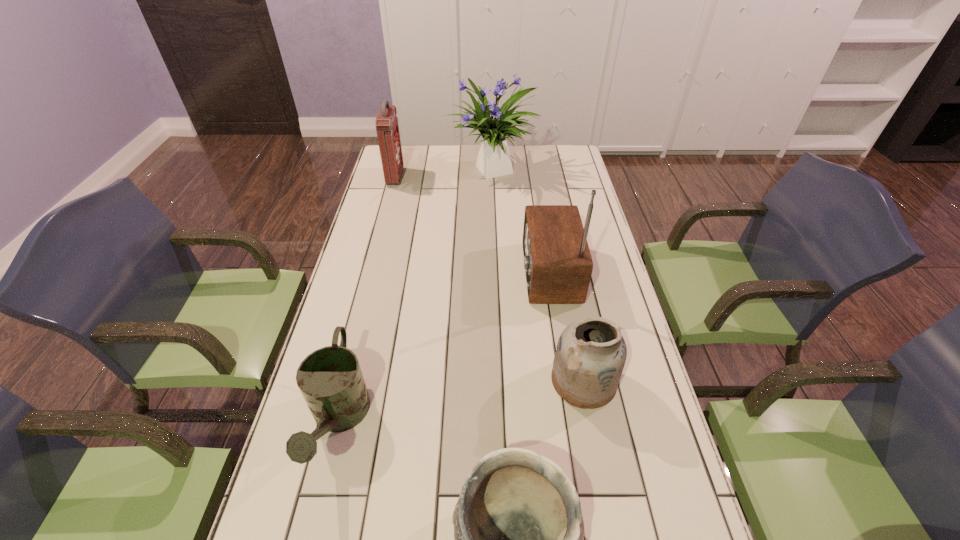
This screenshot has height=540, width=960. In order to click on vacant space at the right edge of the desktop in this screenshot , I will do `click(621, 428)`.

This screenshot has height=540, width=960. I want to click on free space at the far right corner, so click(562, 148).

Identify the location of vacant point located between the watering can and the radio receiver. (444, 347).

Locate an element on the screen. vacant point located between the flower arrangement and the watering can is located at coordinates (415, 296).

Where is `free space between the flower arrangement and the watering can`? Image resolution: width=960 pixels, height=540 pixels. free space between the flower arrangement and the watering can is located at coordinates (415, 296).

Locate an element on the screen. vacant region between the radio receiver and the first-aid kit is located at coordinates (471, 225).

Where is `free point between the third farthest object and the flower arrangement`? The height and width of the screenshot is (540, 960). free point between the third farthest object and the flower arrangement is located at coordinates click(519, 222).

Identify the location of blank region between the taller pottery and the watering can. (461, 401).

You are a GUI agent. You are given a task and a screenshot of the screen. Output one action in this format:
    pyautogui.click(x=<x>, y=<y>)
    Task: Click on the unoccupied position between the flower arrangement and the first-aid kit
    
    Given the screenshot: What is the action you would take?
    pyautogui.click(x=443, y=174)

Identify the location of object that stands as the third closest to the watering can. The width and height of the screenshot is (960, 540). (591, 353).